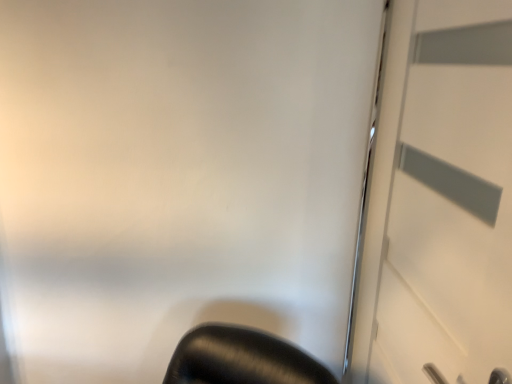
Image resolution: width=512 pixels, height=384 pixels. What do you see at coordinates (439, 200) in the screenshot? I see `white glossy door at right` at bounding box center [439, 200].

Measure the distance between white glossy door at right and camera.

The distance of white glossy door at right from camera is 61.58 centimeters.

Measure the distance between point (479, 133) and camera.

They are 27.99 inches apart.

Where is `white glossy door at right`? This screenshot has height=384, width=512. white glossy door at right is located at coordinates (439, 200).

You are a GUI agent. You are given a task and a screenshot of the screen. Output one action in this format:
    pyautogui.click(x=<x>, y=<y>)
    Task: Click on the white glossy door at right
    The height and width of the screenshot is (384, 512).
    Given the screenshot: What is the action you would take?
    pyautogui.click(x=439, y=200)